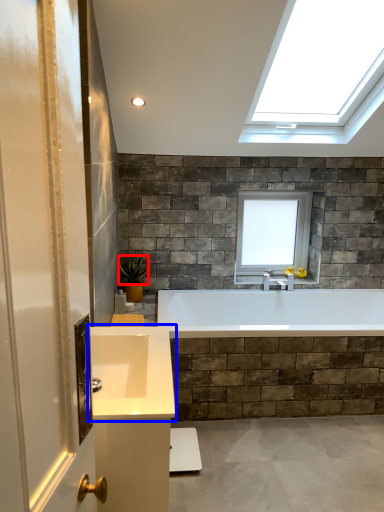
Question: Which object appears closest to the camera in this image, plant (highlighted by a red box) or sink (highlighted by a blue box)?

Choices:
 (A) plant
 (B) sink

Answer: (B)